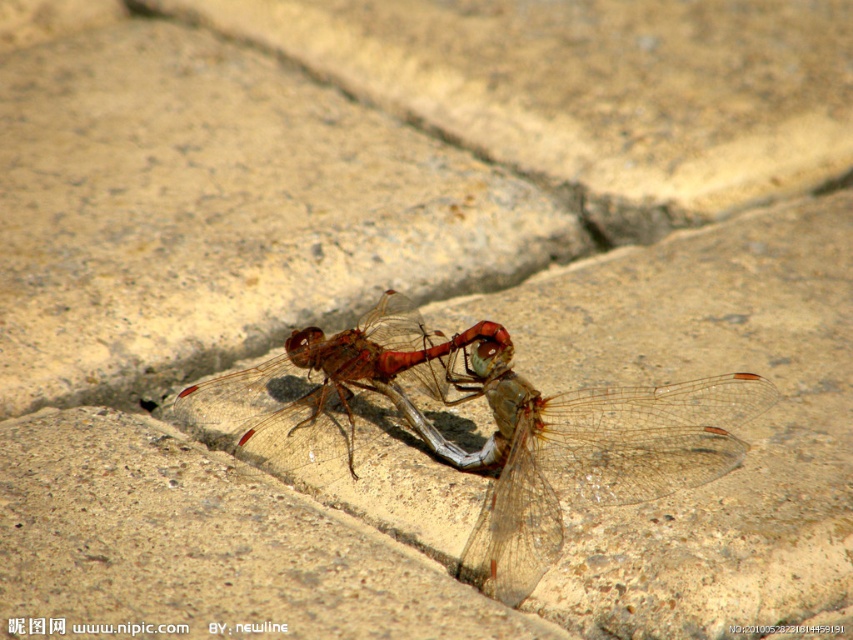
Question: Does translucent winged insect at center have a larger size compared to translucent red dragonfly at center?

Choices:
 (A) no
 (B) yes

Answer: (B)

Question: Is translucent winged insect at center below translucent red dragonfly at center?

Choices:
 (A) yes
 (B) no

Answer: (A)

Question: Which of the following is the farthest from the observer?

Choices:
 (A) (648, 456)
 (B) (315, 376)

Answer: (B)

Question: Among these objects, which one is nearest to the camera?

Choices:
 (A) translucent winged insect at center
 (B) translucent red dragonfly at center

Answer: (A)

Question: Is translucent winged insect at center behind translucent red dragonfly at center?

Choices:
 (A) yes
 (B) no

Answer: (B)

Question: Which point appears farthest from the camera in this image?

Choices:
 (A) (651, 456)
 (B) (427, 339)

Answer: (B)